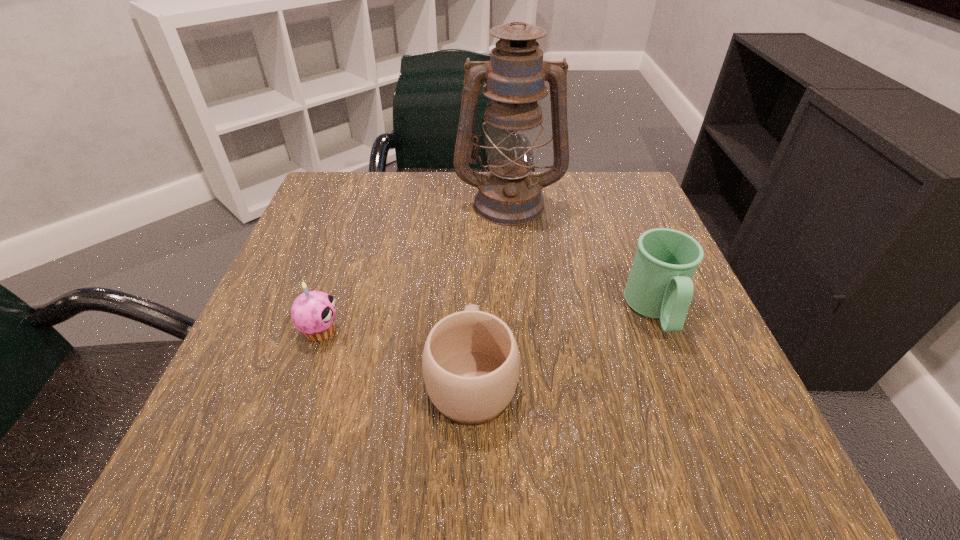
This screenshot has height=540, width=960. In order to click on vacant space at the far right corner of the desktop in this screenshot , I will do `click(585, 176)`.

The height and width of the screenshot is (540, 960). In order to click on vacant space at the near right corner of the desktop in this screenshot , I will do `click(686, 427)`.

Find the location of a particular element. free spot between the oil lamp and the shorter mug is located at coordinates (491, 289).

Find the location of `free space that is in between the shorter mug and the oil lamp`. free space that is in between the shorter mug and the oil lamp is located at coordinates (491, 289).

This screenshot has width=960, height=540. I want to click on free space that is in between the oil lamp and the cupcake, so click(x=415, y=267).

Where is `vacant area that lies between the left mug and the tallest object`? Image resolution: width=960 pixels, height=540 pixels. vacant area that lies between the left mug and the tallest object is located at coordinates (491, 289).

This screenshot has width=960, height=540. What are the coordinates of `free space between the right mug and the shorter mug` in the screenshot? It's located at (564, 343).

The image size is (960, 540). Find the location of `vacant region between the cupcake and the shorter mug`. vacant region between the cupcake and the shorter mug is located at coordinates (396, 354).

This screenshot has width=960, height=540. I want to click on vacant area that lies between the left mug and the leftmost object, so click(x=396, y=354).

The width and height of the screenshot is (960, 540). What are the coordinates of `free spot between the cupcake and the left mug` in the screenshot? It's located at (396, 354).